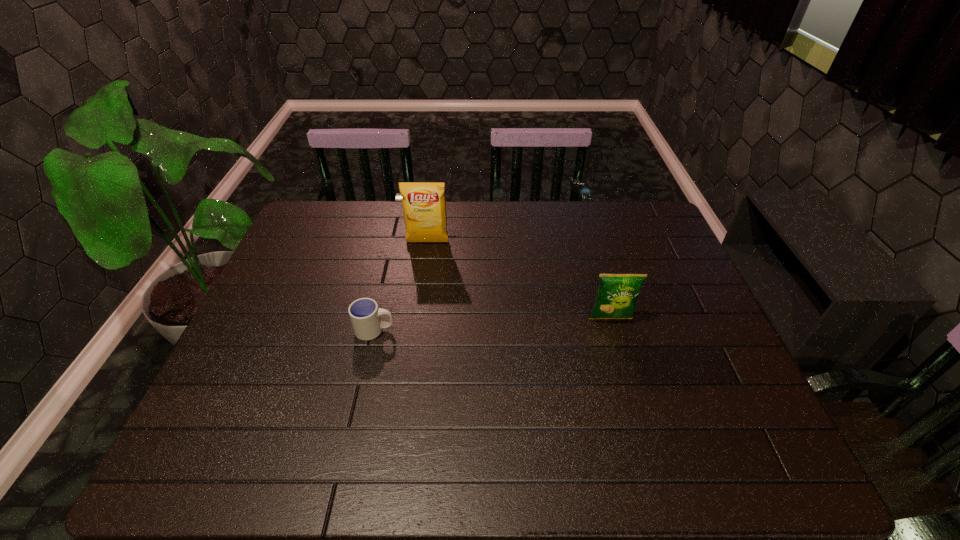
You are a GUI agent. You are given a task and a screenshot of the screen. Output one action in this format:
    pyautogui.click(x=<x>, y=<y>)
    Task: Click on the tallest object
    This screenshot has height=540, width=960.
    Given the screenshot: What is the action you would take?
    (424, 206)

Identify the location of the taller crisp (potato chip). Image resolution: width=960 pixels, height=540 pixels. (424, 206).

The image size is (960, 540). What are the coordinates of `the rightmost object` in the screenshot? It's located at (616, 297).

In order to click on the second tallest object in this screenshot , I will do `click(616, 297)`.

The height and width of the screenshot is (540, 960). Identify the location of cup. (364, 313).

At what (x,y) coordinates should I click in order to perform the action: click on vacant region located on the front of the farthest object with the logo. Please return your answer as a coordinate pair (x, y). Image resolution: width=960 pixels, height=540 pixels. Looking at the image, I should click on (415, 335).

This screenshot has height=540, width=960. Find the location of `free point located on the front-facing side of the second tallest object`. free point located on the front-facing side of the second tallest object is located at coordinates pos(633,395).

This screenshot has width=960, height=540. In order to click on vacant space situated with the handle on the side of the cup in this screenshot , I will do `click(540, 330)`.

At what (x,y) coordinates should I click in order to perform the action: click on object situated at the far edge. Please return your answer as a coordinate pair (x, y). Looking at the image, I should click on (424, 206).

Image resolution: width=960 pixels, height=540 pixels. I want to click on vacant region at the far edge of the desktop, so click(506, 233).